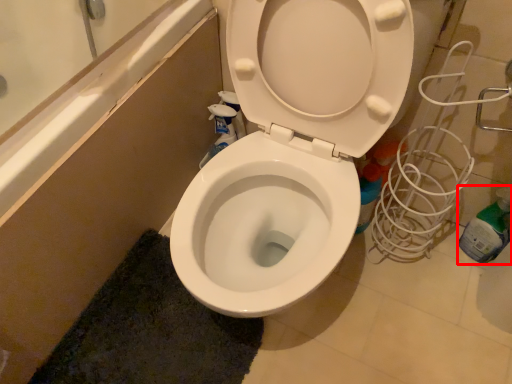
Question: Considering the relative positions of bottle (annotated by the red box) and bath mat in the image provided, where is bottle (annotated by the red box) located with respect to the staircase?

Choices:
 (A) left
 (B) right

Answer: (B)